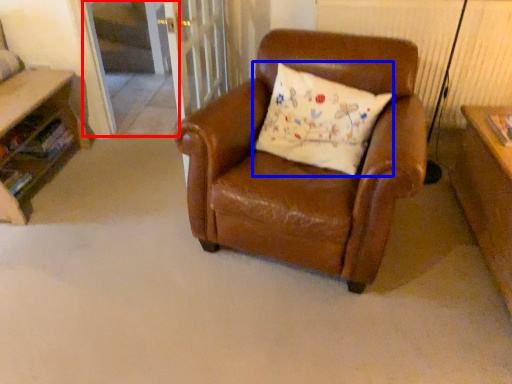
Question: Which object is closer to the camera taking this photo, screen door (highlighted by a red box) or pillow (highlighted by a blue box)?

Choices:
 (A) screen door
 (B) pillow

Answer: (B)